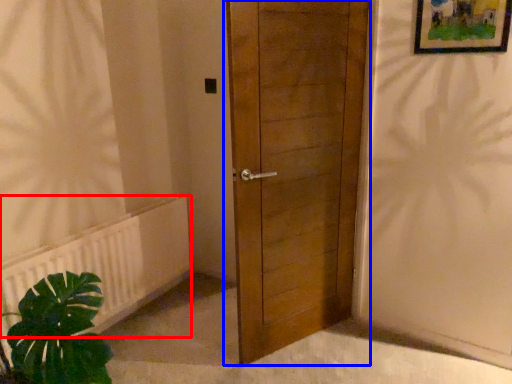
Question: Which of the following is the farthest to the observer, radiator (highlighted by a red box) or door (highlighted by a blue box)?

Choices:
 (A) radiator
 (B) door

Answer: (A)